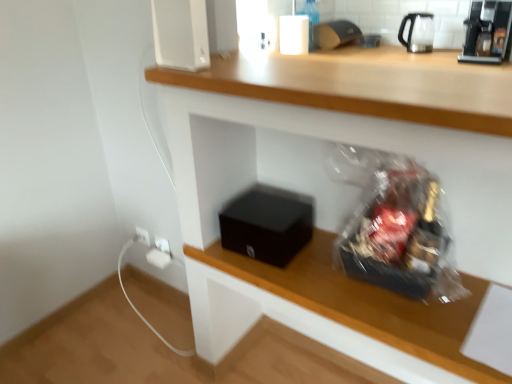
What is the approximate width of white plastic electric outlet at lower left?

white plastic electric outlet at lower left is 4.86 centimeters wide.

Measure the distance between point (169, 256) and camera.

They are 6.15 feet apart.

This screenshot has width=512, height=384. What do you see at coordinates (267, 224) in the screenshot? I see `black matte box at center` at bounding box center [267, 224].

Where is `transparent glass tea pot at upper right`? This screenshot has width=512, height=384. transparent glass tea pot at upper right is located at coordinates (418, 32).

Find the location of a particular element. This screenshot has height=384, width=512. black plastic coffee machine at upper right is located at coordinates (487, 32).

Locate an element on the screen. This screenshot has height=384, width=512. white plastic electric outlet at lower left is located at coordinates (162, 245).

Which of these two, black matte box at center or black plastic coffee machine at upper right, is thinner?

With smaller width is black matte box at center.

Considering the relative sizes of black matte box at center and black plastic coffee machine at upper right in the image provided, is black matte box at center taller than black plastic coffee machine at upper right?

No, black matte box at center is not taller than black plastic coffee machine at upper right.

From the image's perspective, is black matte box at center on black plastic coffee machine at upper right?

No, from the image's perspective, black matte box at center is not above black plastic coffee machine at upper right.

Which is more to the right, black plastic coffee machine at upper right or white plastic electric outlet at lower left?

→ black plastic coffee machine at upper right is more to the right.

Can you confirm if black plastic coffee machine at upper right is bigger than white plastic electric outlet at lower left?

Yes.

Looking at this image, from the image's perspective, is black plastic coffee machine at upper right under white plastic electric outlet at lower left?

No.

Would you consider clear glass bottle at upper center to be distant from black matte box at lower center?

That's right, there is a large distance between clear glass bottle at upper center and black matte box at lower center.

Is clear glass bottle at upper center positioned beyond the bounds of black matte box at lower center?

Yes, clear glass bottle at upper center is outside of black matte box at lower center.

From the image's perspective, is clear glass bottle at upper center located above black matte box at lower center?

Yes, from the image's perspective, clear glass bottle at upper center is above black matte box at lower center.

Is transparent glass tea pot at upper right wider or thinner than black matte box at lower center?

Considering their sizes, transparent glass tea pot at upper right looks slimmer than black matte box at lower center.

Is transparent glass tea pot at upper right beside black matte box at lower center?

transparent glass tea pot at upper right is not next to black matte box at lower center, and they're not touching.

Considering the sizes of transparent glass tea pot at upper right and black matte box at lower center in the image, is transparent glass tea pot at upper right bigger or smaller than black matte box at lower center?

Clearly, transparent glass tea pot at upper right is smaller in size than black matte box at lower center.

Is transparent glass tea pot at upper right facing away from black matte box at lower center?

No, transparent glass tea pot at upper right is not facing away from black matte box at lower center.

Find the location of a particular element. The image size is (512, 384). electric outlet on the left of the clear glass bottle at upper center is located at coordinates (162, 245).

Considering the sizes of objects clear glass bottle at upper center and white plastic electric outlet at lower left in the image provided, who is smaller, clear glass bottle at upper center or white plastic electric outlet at lower left?

white plastic electric outlet at lower left is smaller.

Who is bigger, transparent glass tea pot at upper right or clear glass bottle at upper center?

transparent glass tea pot at upper right is bigger.

Image resolution: width=512 pixels, height=384 pixels. In order to click on bottle behind the transparent glass tea pot at upper right in this screenshot , I will do `click(311, 20)`.

From their relative heights in the image, would you say transparent glass tea pot at upper right is taller or shorter than clear glass bottle at upper center?

transparent glass tea pot at upper right is shorter than clear glass bottle at upper center.

Which object is positioned more to the right, white plastic electric outlet at lower left or transparent glass tea pot at upper right?

transparent glass tea pot at upper right.

Is the position of white plastic electric outlet at lower left more distant than that of transparent glass tea pot at upper right?

No, white plastic electric outlet at lower left is closer to the camera.

Are white plastic electric outlet at lower left and transparent glass tea pot at upper right far apart?

Indeed, white plastic electric outlet at lower left is not near transparent glass tea pot at upper right.

From a real-world perspective, between white plastic electric outlet at lower left and transparent glass tea pot at upper right, who is vertically higher?

transparent glass tea pot at upper right, from a real-world perspective.

I want to click on coffee machine on the right of the black matte box at center, so click(487, 32).

At what (x,y) coordinates should I click in order to perform the action: click on coffee machine above the white plastic electric outlet at lower left (from the image's perspective). Please return your answer as a coordinate pair (x, y). The image size is (512, 384). Looking at the image, I should click on (487, 32).

Estimate the real-world distances between objects in this image. Which object is closer to black matte box at lower center, clear glass bottle at upper center or black matte box at center?

black matte box at center is closer to black matte box at lower center.

Based on their spatial positions, is black plastic coffee machine at upper right or black matte box at lower center closer to white plastic electric outlet at lower left?

The object closer to white plastic electric outlet at lower left is black matte box at lower center.

From the image, which object appears to be nearer to clear glass bottle at upper center, black matte box at center or black matte box at lower center?

The object closer to clear glass bottle at upper center is black matte box at center.

From the image, which object appears to be nearer to transparent glass tea pot at upper right, black matte box at lower center or black plastic coffee machine at upper right?

The object closer to transparent glass tea pot at upper right is black plastic coffee machine at upper right.

Which object lies further to the anchor point white plastic electric outlet at lower left, black matte box at lower center or black plastic coffee machine at upper right?

black plastic coffee machine at upper right.

From the picture: Looking at the image, which one is located further to black plastic coffee machine at upper right, clear glass bottle at upper center or white plastic electric outlet at lower left?

Based on the image, white plastic electric outlet at lower left appears to be further to black plastic coffee machine at upper right.

Based on their spatial positions, is black plastic coffee machine at upper right or transparent glass tea pot at upper right further from black matte box at center?

The object further to black matte box at center is transparent glass tea pot at upper right.

Estimate the real-world distances between objects in this image. Which object is further from white plastic electric outlet at lower left, black matte box at lower center or transparent glass tea pot at upper right?

transparent glass tea pot at upper right is positioned further to the anchor white plastic electric outlet at lower left.

The image size is (512, 384). I want to click on tea pot between white plastic electric outlet at lower left and black plastic coffee machine at upper right, so click(x=418, y=32).

Where is `box between black matte box at lower center and white plastic electric outlet at lower left in the front-back direction`? box between black matte box at lower center and white plastic electric outlet at lower left in the front-back direction is located at coordinates (267, 224).

This screenshot has width=512, height=384. I want to click on tea pot between black matte box at center and clear glass bottle at upper center in the front-back direction, so click(418, 32).

This screenshot has height=384, width=512. I want to click on coffee machine located between black matte box at lower center and clear glass bottle at upper center in the depth direction, so click(487, 32).